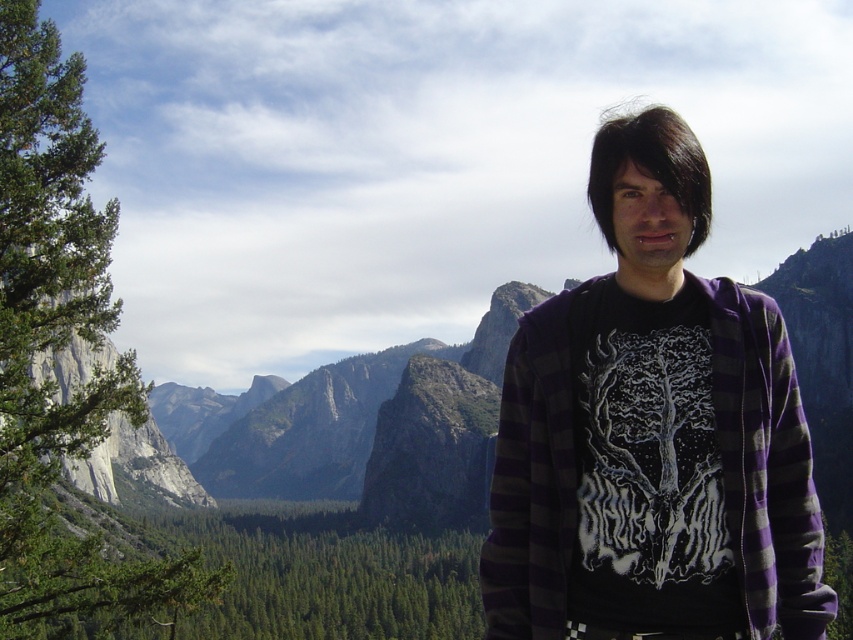
You are a photographer planning to take a portrait of the person wearing the purple flannel shirt at center and the green leafy tree at left. Which object is located to the right of the other?

The purple flannel shirt at center is positioned on the right side of green leafy tree at left, so the purple flannel shirt at center is to the right of the green leafy tree at left.

You are a photographer setting up a shot of the purple flannel shirt at center and the green leafy tree at left. Which object appears larger in the photo?

The green leafy tree at left appears larger than the purple flannel shirt at center in the photo.

You are taking a photo of the person in the scene. You want to focus on the point closer to the camera between the two points labeled as point (544, 374) and point (120, 365). Which point should you focus on?

You should focus on point (544, 374) because it is closer to the camera than point (120, 365).